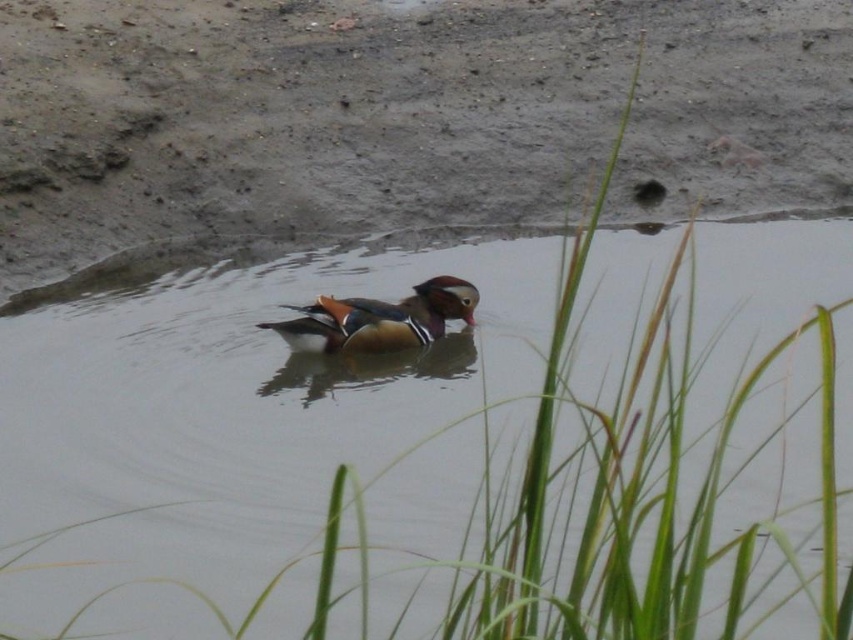
Question: Which object is closer to the camera taking this photo?

Choices:
 (A) shiny brown wood duck at center
 (B) brown matte mud at center

Answer: (A)

Question: Which point is farther from the camera taking this photo?

Choices:
 (A) (454, 93)
 (B) (381, 317)

Answer: (A)

Question: Which object is farther from the camera taking this photo?

Choices:
 (A) shiny brown wood duck at center
 (B) brown matte mud at center

Answer: (B)

Question: Does brown matte mud at center have a smaller size compared to shiny brown wood duck at center?

Choices:
 (A) no
 (B) yes

Answer: (A)

Question: Does brown matte mud at center appear over shiny brown wood duck at center?

Choices:
 (A) yes
 (B) no

Answer: (A)

Question: Is brown matte mud at center smaller than shiny brown wood duck at center?

Choices:
 (A) yes
 (B) no

Answer: (B)